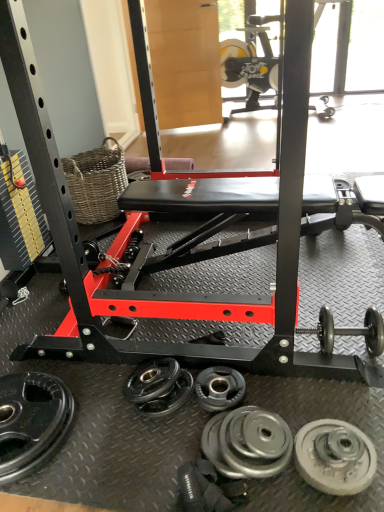
Find the location of `free space to the left of black rubber weight plate at center, the third wheel viewed from the right`. free space to the left of black rubber weight plate at center, the third wheel viewed from the right is located at coordinates (160, 425).